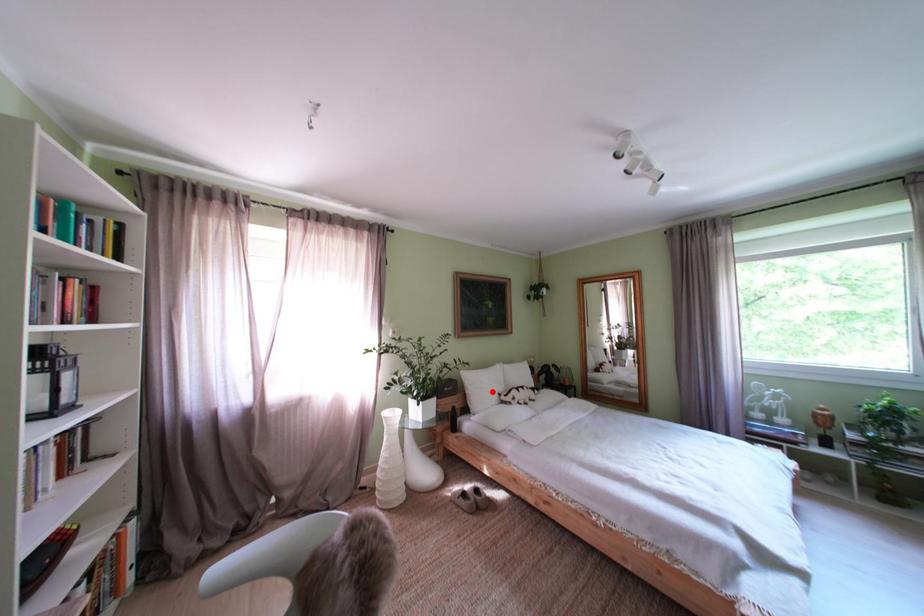
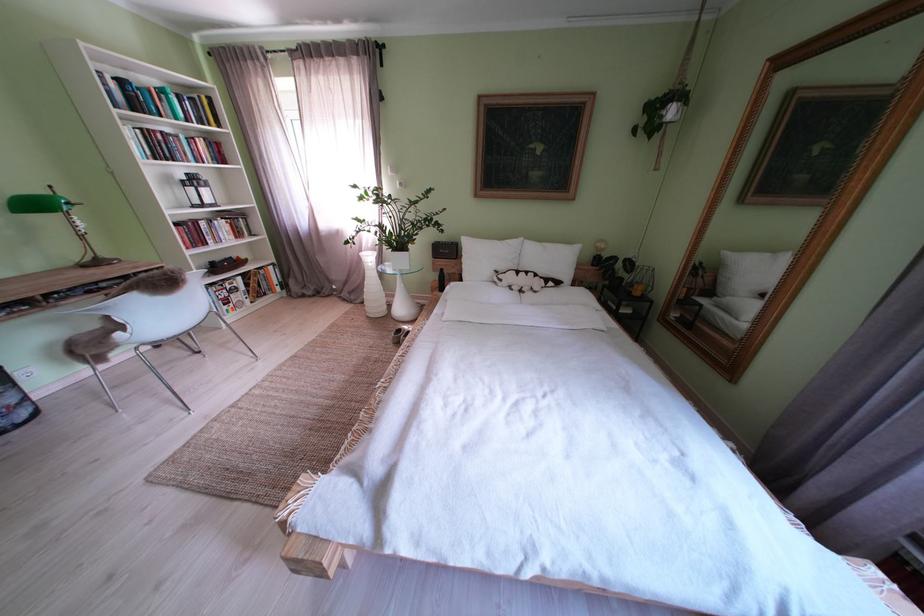
Question: I am providing you with two images of the same scene from different viewpoints. Image1 has a red point marked. In image2, the corresponding 3D location appears at what relative position? Reply with the corresponding letter.

Choices:
 (A) Closer
 (B) Farther

Answer: (A)